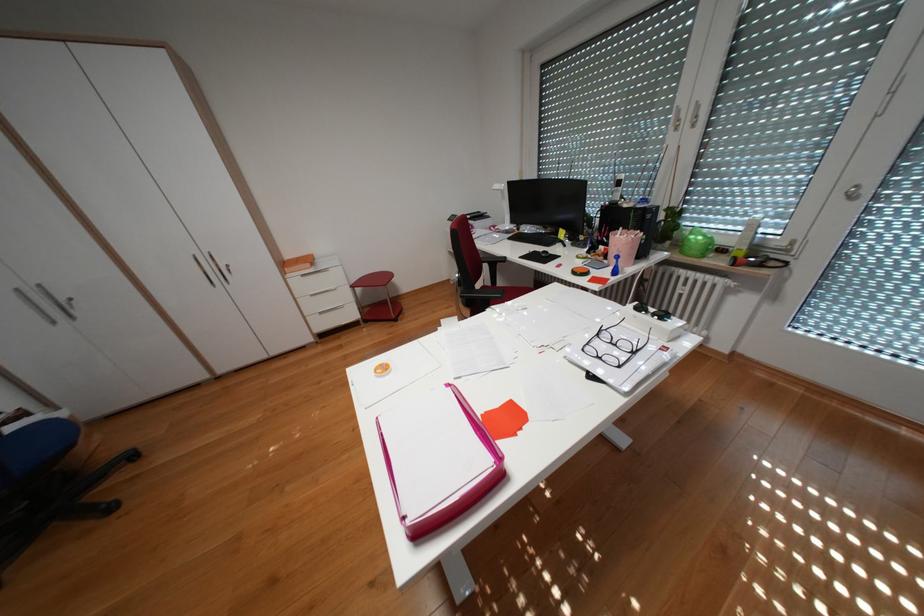
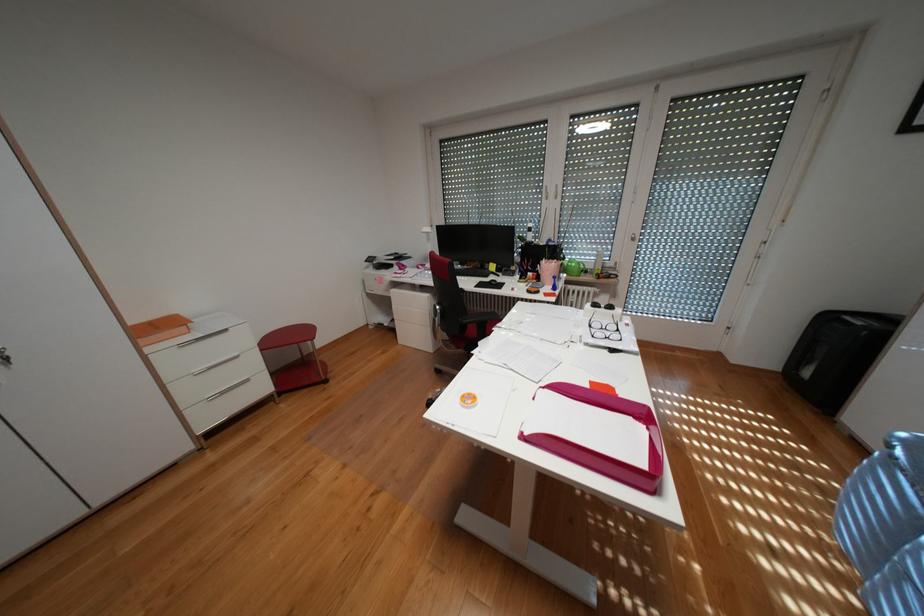
The point at (610, 334) is marked in the first image. Where is the corresponding point in the second image?

(602, 325)